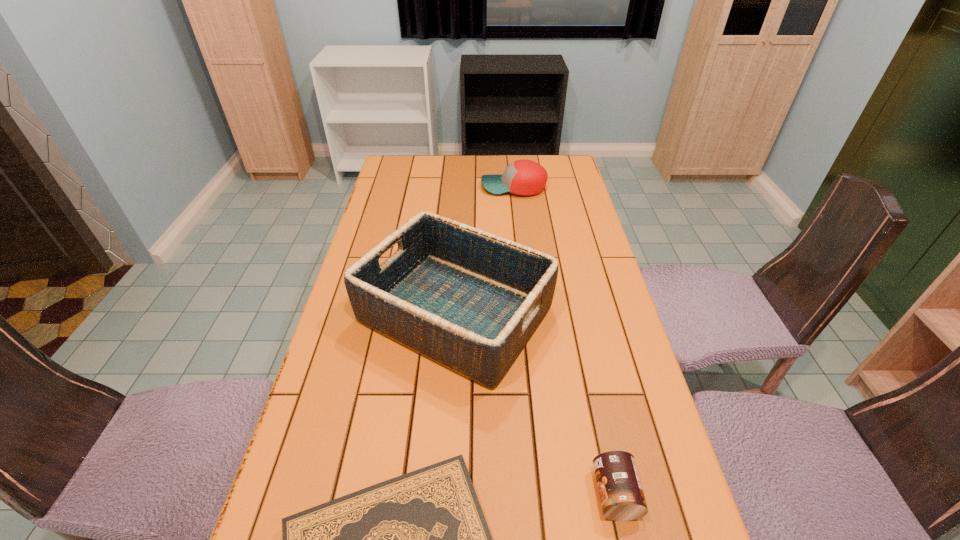
Locate an element on the screen. Image resolution: width=960 pixels, height=540 pixels. free region at the far right corner is located at coordinates (565, 175).

Identify the location of empty space that is in between the baseball cap and the can. (564, 340).

Image resolution: width=960 pixels, height=540 pixels. I want to click on free space between the can and the second farthest object, so click(535, 403).

Where is `vacant space that is in between the baseball cap and the third tallest object`? vacant space that is in between the baseball cap and the third tallest object is located at coordinates (564, 340).

Locate an element on the screen. The image size is (960, 540). vacant space in between the tallest object and the second shortest object is located at coordinates (535, 403).

Where is `vacant region between the can and the second farthest object`? vacant region between the can and the second farthest object is located at coordinates (535, 403).

This screenshot has width=960, height=540. Identify the location of object that is the closest to the third tallest object. (421, 539).

Point out which object is positioned as the third nearest to the second shortest object. Please provide its 2D coordinates. Your answer should be formatted as a tuple, i.e. [(x, y)], where the tuple contains the x and y coordinates of a point satisfying the conditions above.

[(522, 177)]